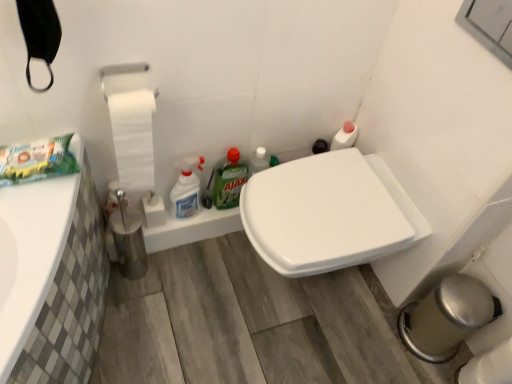
Question: Considering the relative sizes of white matte toilet paper at left and green matte ajax at center, the first cleaning product when ordered from right to left, in the image provided, is white matte toilet paper at left taller than green matte ajax at center, the first cleaning product when ordered from right to left,?

Choices:
 (A) yes
 (B) no

Answer: (A)

Question: Is white matte toilet paper at left behind green matte ajax at center, arranged as the 2th cleaning product when viewed from the left?

Choices:
 (A) no
 (B) yes

Answer: (A)

Question: From a real-world perspective, is white matte toilet paper at left under green matte ajax at center, the first cleaning product when ordered from right to left?

Choices:
 (A) yes
 (B) no

Answer: (B)

Question: Is white matte toilet paper at left positioned in front of green matte ajax at center, arranged as the 2th cleaning product when viewed from the left?

Choices:
 (A) yes
 (B) no

Answer: (A)

Question: From the image's perspective, is white matte toilet paper at left located above green matte ajax at center, the first cleaning product when ordered from right to left?

Choices:
 (A) no
 (B) yes

Answer: (B)

Question: Does white matte toilet paper at left have a larger size compared to green matte ajax at center, arranged as the 2th cleaning product when viewed from the left?

Choices:
 (A) no
 (B) yes

Answer: (B)

Question: Are green matte ajax at center, the first cleaning product when ordered from right to left, and white glossy toilet seat at center beside each other?

Choices:
 (A) yes
 (B) no

Answer: (B)

Question: From a real-world perspective, is green matte ajax at center, arranged as the 2th cleaning product when viewed from the left, located higher than white glossy toilet seat at center?

Choices:
 (A) no
 (B) yes

Answer: (B)

Question: Is white glossy toilet seat at center located within green matte ajax at center, arranged as the 2th cleaning product when viewed from the left?

Choices:
 (A) no
 (B) yes

Answer: (A)

Question: Is green matte ajax at center, the first cleaning product when ordered from right to left, taller than white glossy toilet seat at center?

Choices:
 (A) yes
 (B) no

Answer: (B)

Question: From the image's perspective, is green matte ajax at center, arranged as the 2th cleaning product when viewed from the left, on white glossy toilet seat at center?

Choices:
 (A) no
 (B) yes

Answer: (B)

Question: Would you consider green matte ajax at center, the first cleaning product when ordered from right to left, to be distant from white glossy toilet seat at center?

Choices:
 (A) no
 (B) yes

Answer: (A)

Question: Considering the relative sizes of white glossy spray bottle at center, the first cleaning product in the left-to-right sequence, and white matte toilet paper at left in the image provided, is white glossy spray bottle at center, the first cleaning product in the left-to-right sequence, shorter than white matte toilet paper at left?

Choices:
 (A) yes
 (B) no

Answer: (A)